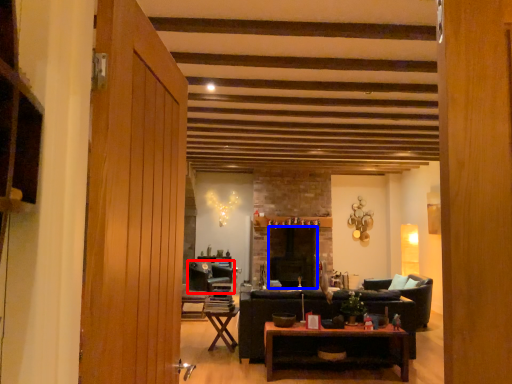
Question: Which of the following is the closest to the observer, chair (highlighted by a red box) or fireplace (highlighted by a blue box)?

Choices:
 (A) chair
 (B) fireplace

Answer: (A)